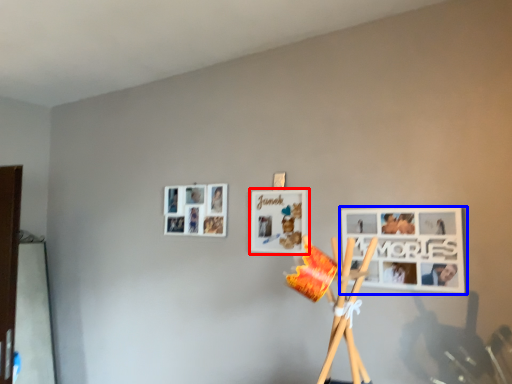
Question: Which point is closer to the camera, picture frame (highlighted by a red box) or picture frame (highlighted by a blue box)?

Choices:
 (A) picture frame
 (B) picture frame

Answer: (B)